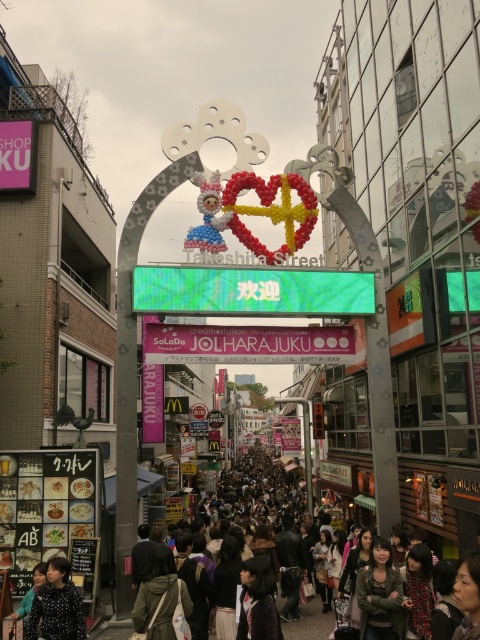
Which of these two, pink fabric banner at center or green textured jacket at lower right, stands taller?

green textured jacket at lower right is taller.

How distant is pink fabric banner at center from green textured jacket at lower right?

A distance of 20.53 meters exists between pink fabric banner at center and green textured jacket at lower right.

Is point (252, 328) more distant than point (400, 616)?

Yes, point (252, 328) is behind point (400, 616).

Identify the location of pink fabric banner at center. This screenshot has height=640, width=480. (248, 342).

Does pink fabric banner at center have a greater width compared to dark gray clothing at center?

No, pink fabric banner at center is not wider than dark gray clothing at center.

Does point (164, 339) come in front of point (280, 470)?

Yes, it is.

Between point (326, 336) and point (265, 460), which one is positioned behind?

Point (265, 460)

The image size is (480, 640). Find the location of `pink fabric banner at center`. pink fabric banner at center is located at coordinates (248, 342).

Between point (82, 636) and point (233, 497), which one is positioned in front?

Point (82, 636)

What do you see at coordinates (57, 605) in the screenshot?
I see `polka dot blouse at lower left` at bounding box center [57, 605].

Which is in front, point (66, 584) or point (236, 481)?

Positioned in front is point (66, 584).

The width and height of the screenshot is (480, 640). I want to click on polka dot blouse at lower left, so click(57, 605).